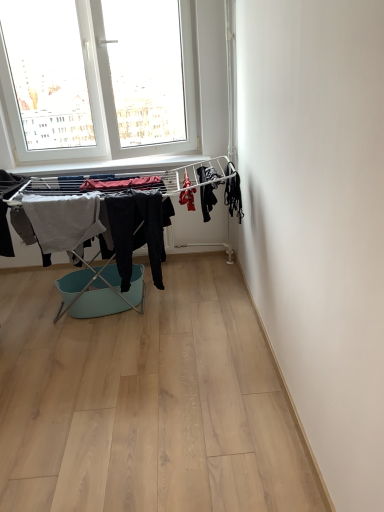
Question: Is red fabric at center, the 3th clothing positioned from the left, wider or thinner than dark gray fabric pants at center, which is the second clothing in left-to-right order?

Choices:
 (A) thin
 (B) wide

Answer: (A)

Question: From the image's perspective, relative to dark gray fabric pants at center, which is the second clothing in left-to-right order, is red fabric at center, the 3th clothing positioned from the left, above or below?

Choices:
 (A) below
 (B) above

Answer: (B)

Question: Based on their relative distances, which object is farther from the black matte fabric at right, which ranks as the fifth clothing in left-to-right order?

Choices:
 (A) light gray cotton towel at left, which is counted as the 5th clothing, starting from the right
 (B) red fabric at center, the 3th clothing positioned from the left
 (C) dark gray fabric at center, placed as the 4th clothing when sorted from left to right
 (D) mint plastic laundry basket at center
 (E) dark gray fabric pants at center, the 4th clothing in the right-to-left sequence

Answer: (A)

Question: Estimate the real-world distances between objects in this image. Which object is closer to the dark gray fabric pants at center, the 4th clothing in the right-to-left sequence?

Choices:
 (A) light gray cotton towel at left, which is counted as the 5th clothing, starting from the right
 (B) red fabric at center, the 3th clothing positioned from the left
 (C) black matte fabric at right, which ranks as the first clothing in right-to-left order
 (D) mint plastic laundry basket at center
 (E) dark gray fabric at center, placed as the 4th clothing when sorted from left to right

Answer: (A)